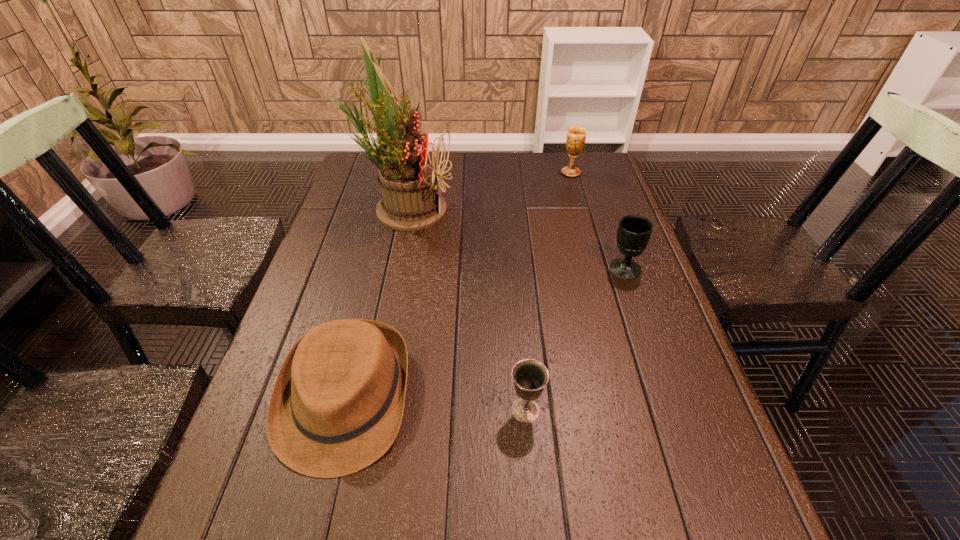
Identify the location of free space located on the back of the shortest chalice. coord(522,366).

Locate an element on the screen. This screenshot has height=540, width=960. flower arrangement that is at the far edge is located at coordinates (408, 180).

Image resolution: width=960 pixels, height=540 pixels. I want to click on chalice located at the far edge, so 576,136.

Find the location of a particular element. This screenshot has height=540, width=960. flower arrangement that is at the left edge is located at coordinates (408, 180).

Image resolution: width=960 pixels, height=540 pixels. What are the coordinates of `fedora present at the left edge` in the screenshot? It's located at (337, 404).

At what (x,y) coordinates should I click in order to perform the action: click on object located in the far left corner section of the desktop. Please return your answer as a coordinate pair (x, y). The width and height of the screenshot is (960, 540). Looking at the image, I should click on (408, 180).

At what (x,y) coordinates should I click in order to perform the action: click on object at the far right corner. Please return your answer as a coordinate pair (x, y). Image resolution: width=960 pixels, height=540 pixels. Looking at the image, I should click on (576, 136).

Identify the location of vacant space at the far edge of the desktop. (462, 181).

Where is `free region at the left edge of the desktop`? This screenshot has height=540, width=960. free region at the left edge of the desktop is located at coordinates (322, 262).

You are a GUI agent. You are given a task and a screenshot of the screen. Output one action in this format:
    pyautogui.click(x=<x>, y=<y>)
    Task: Click on the blank space at the right edge of the desktop
    The height and width of the screenshot is (540, 960).
    Given the screenshot: What is the action you would take?
    pyautogui.click(x=716, y=501)